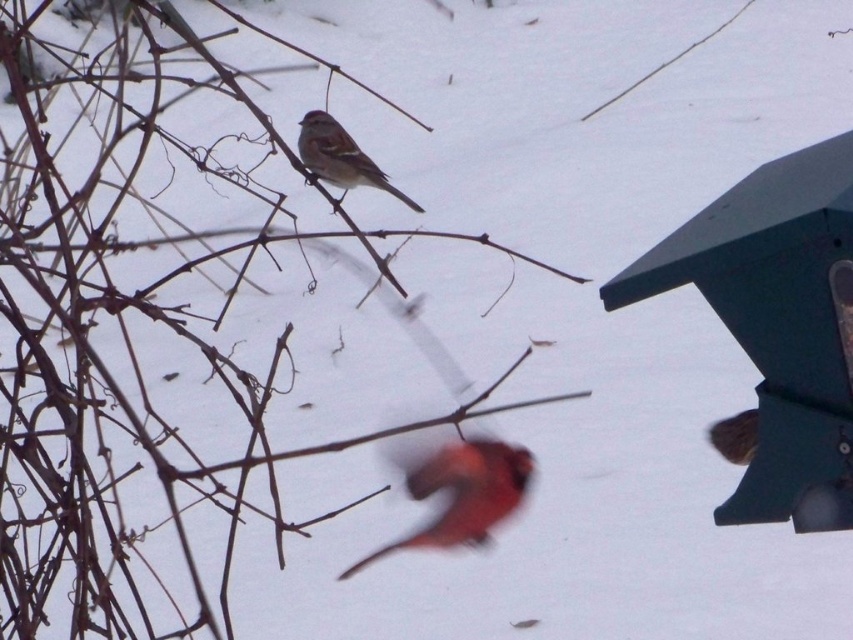
You are a nature photographer trying to capture both the blurred orange bird at center and the brown matte sparrow at center in a single shot. Based on their positions, which bird should you adjust your camera focus to prioritize to ensure both are in frame?

The blurred orange bird at center is to the right of the brown matte sparrow at center. To ensure both are in frame, prioritize focusing on the brown matte sparrow at center first, as it is closer to the left edge, allowing you to adjust the camera to include both birds from left to right.

You are a birdwatcher trying to identify the birds in the image. According to the scene, which bird is taller between the blurred orange bird at center and the brown matte sparrow at center?

The blurred orange bird at center is much taller than the brown matte sparrow at center.

You are a photographer trying to capture both the blurred orange bird at center and the brown matte sparrow at center in a single focused shot. Based on their positions, which bird should you adjust your camera focus on to ensure both are in focus?

You should focus on the brown matte sparrow at center because the blurred orange bird at center is closer to the viewer, and adjusting focus to the farther bird ensures both are within the depth of field.